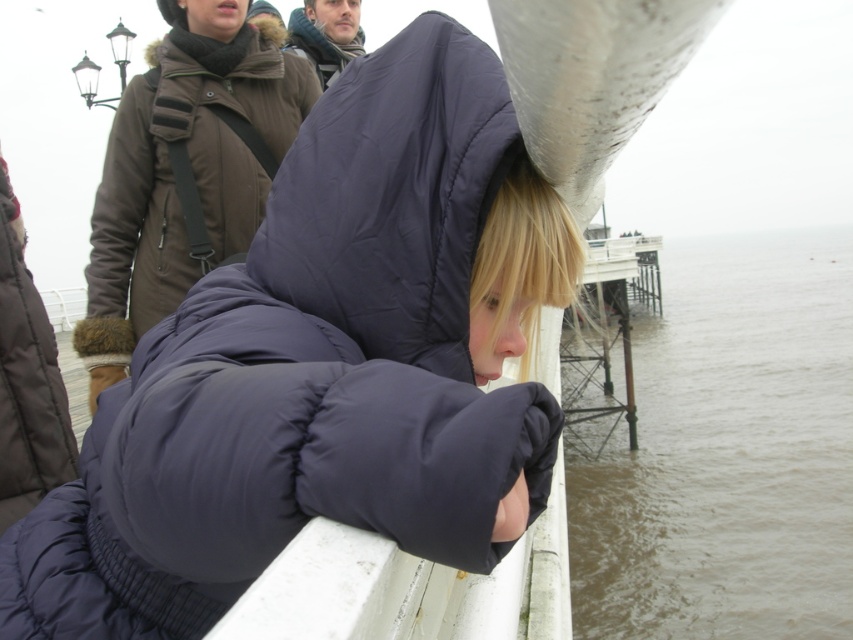
Does brown murky water at lower right lie in front of dark brown woolen coat at upper center?

That is False.

Is point (850, 292) in front of point (352, 36)?

No, it is not.

The width and height of the screenshot is (853, 640). Identify the location of brown murky water at lower right. (727, 452).

In order to click on brown murky water at lower right in this screenshot , I will do `click(727, 452)`.

Who is higher up, dark brown puffy coat at upper center or dark brown woolen coat at upper center?

dark brown woolen coat at upper center is higher up.

Is dark brown puffy coat at upper center above dark brown woolen coat at upper center?

No.

Who is more distant from viewer, (131,160) or (347,8)?

The point (347,8) is more distant.

I want to click on dark brown puffy coat at upper center, so click(x=184, y=170).

Is brown murky water at lower right positioned before dark brown puffy coat at upper center?

No, it is behind dark brown puffy coat at upper center.

Which is in front, point (790, 516) or point (172, 72)?

Point (172, 72) is more forward.

Does point (840, 440) come closer to viewer compared to point (146, 129)?

No, (840, 440) is further to viewer.

At what (x,y) coordinates should I click in order to perform the action: click on brown murky water at lower right. Please return your answer as a coordinate pair (x, y). Looking at the image, I should click on (727, 452).